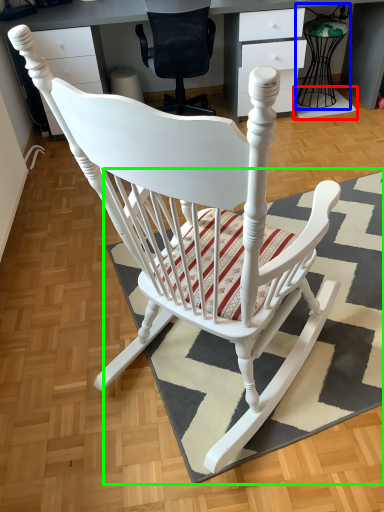
Question: Which object is positioned closest to doormat (highlighted by a red box)? Select from feeding chair (highlighted by a blue box) and doormat (highlighted by a green box).

Choices:
 (A) feeding chair
 (B) doormat

Answer: (A)